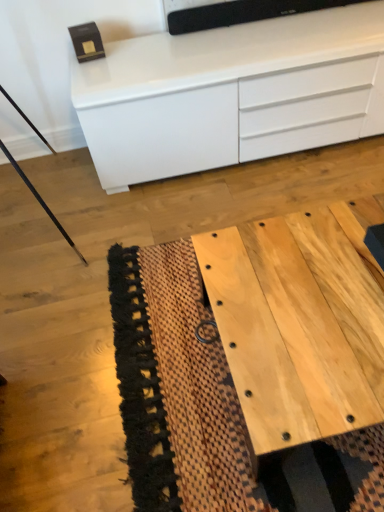
Question: Based on their sizes in the image, would you say white glossy chest of drawers at upper center is bigger or smaller than natural wood table at lower right?

Choices:
 (A) small
 (B) big

Answer: (B)

Question: Is white glossy chest of drawers at upper center taller or shorter than natural wood table at lower right?

Choices:
 (A) short
 (B) tall

Answer: (B)

Question: Do you think white glossy chest of drawers at upper center is within natural wood table at lower right, or outside of it?

Choices:
 (A) outside
 (B) inside

Answer: (A)

Question: Considering the positions of natural wood table at lower right and white glossy chest of drawers at upper center in the image, is natural wood table at lower right bigger or smaller than white glossy chest of drawers at upper center?

Choices:
 (A) big
 (B) small

Answer: (B)

Question: Considering the relative positions of natural wood table at lower right and white glossy chest of drawers at upper center in the image provided, is natural wood table at lower right to the left or to the right of white glossy chest of drawers at upper center?

Choices:
 (A) left
 (B) right

Answer: (B)

Question: Is natural wood table at lower right in front of or behind white glossy chest of drawers at upper center in the image?

Choices:
 (A) front
 (B) behind

Answer: (A)

Question: From their relative heights in the image, would you say natural wood table at lower right is taller or shorter than white glossy chest of drawers at upper center?

Choices:
 (A) tall
 (B) short

Answer: (B)